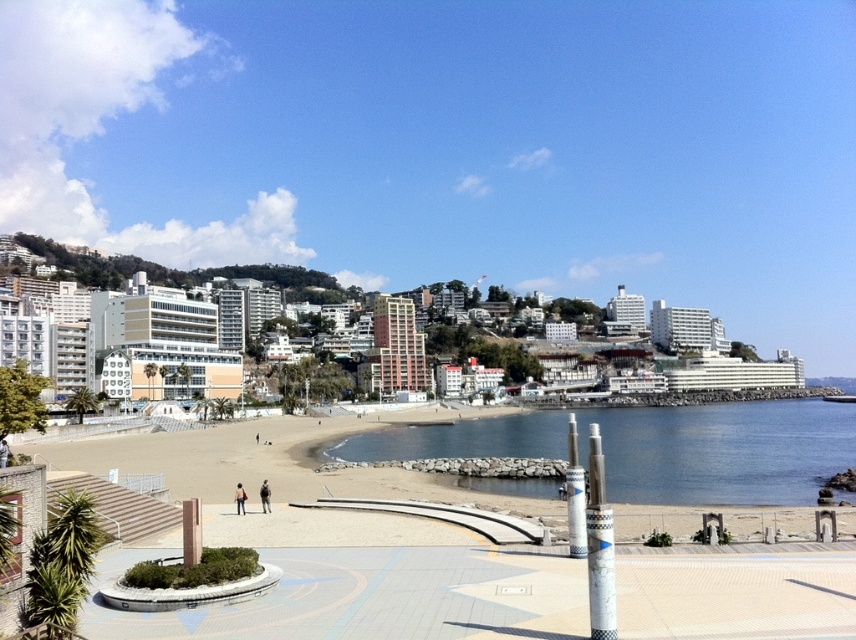
Question: Can you confirm if beige sand at center is bigger than clear blue water at center?

Choices:
 (A) yes
 (B) no

Answer: (A)

Question: Does clear blue water at center appear under green grassy hillside at upper center?

Choices:
 (A) yes
 (B) no

Answer: (A)

Question: Based on their relative distances, which object is farther from the green grassy hillside at upper center?

Choices:
 (A) clear blue water at center
 (B) beige sand at center

Answer: (A)

Question: Which of the following is the closest to the observer?

Choices:
 (A) beige sand at center
 (B) clear blue water at center

Answer: (B)

Question: Which object appears farthest from the camera in this image?

Choices:
 (A) beige sand at center
 (B) green grassy hillside at upper center
 (C) clear blue water at center

Answer: (B)

Question: Does clear blue water at center have a greater width compared to green grassy hillside at upper center?

Choices:
 (A) no
 (B) yes

Answer: (B)